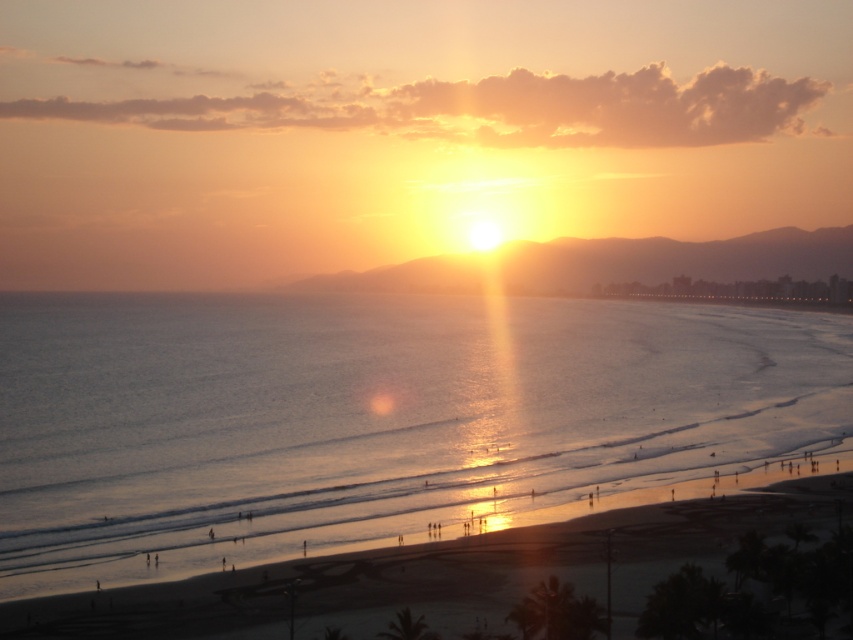
Question: Is shiny blue water at center smaller than sandy beach at lower center?

Choices:
 (A) no
 (B) yes

Answer: (A)

Question: Does shiny blue water at center appear over sandy beach at lower center?

Choices:
 (A) yes
 (B) no

Answer: (A)

Question: Among these points, which one is nearest to the camera?

Choices:
 (A) (358, 618)
 (B) (271, 340)

Answer: (A)

Question: Can you confirm if shiny blue water at center is thinner than sandy beach at lower center?

Choices:
 (A) yes
 (B) no

Answer: (B)